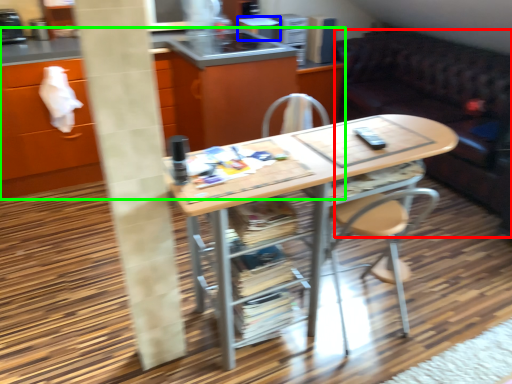
Question: Considering the real-world distances, which object is closest to studio couch (highlighted by a red box)? appliance (highlighted by a blue box) or cabinetry (highlighted by a green box).

Choices:
 (A) appliance
 (B) cabinetry

Answer: (A)